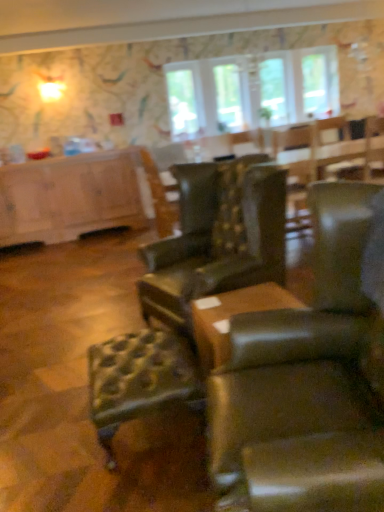
Question: Does leather tufted bar stool at center have a larger size compared to clear glass window at upper center, arranged as the 2th window screen when viewed from the right?

Choices:
 (A) no
 (B) yes

Answer: (B)

Question: Is leather tufted bar stool at center oriented towards clear glass window at upper center, arranged as the 2th window screen when viewed from the right?

Choices:
 (A) yes
 (B) no

Answer: (B)

Question: From the image's perspective, would you say leather tufted bar stool at center is shown under clear glass window at upper center, arranged as the 2th window screen when viewed from the right?

Choices:
 (A) yes
 (B) no

Answer: (A)

Question: Is leather tufted bar stool at center far from clear glass window at upper center, arranged as the 2th window screen when viewed from the right?

Choices:
 (A) no
 (B) yes

Answer: (B)

Question: Is leather tufted bar stool at center next to clear glass window at upper center, which appears as the first window screen when viewed from the left, and touching it?

Choices:
 (A) no
 (B) yes

Answer: (A)

Question: Can you confirm if leather tufted bar stool at center is positioned to the left of clear glass window at upper center, arranged as the 2th window screen when viewed from the right?

Choices:
 (A) yes
 (B) no

Answer: (A)

Question: From the image's perspective, is leather at center, the second chair from the back, beneath clear glass window at upper center, arranged as the 2th window screen when viewed from the right?

Choices:
 (A) no
 (B) yes

Answer: (B)

Question: From the image's perspective, is leather at center, which appears as the 1th chair when viewed from the front, on top of clear glass window at upper center, arranged as the 2th window screen when viewed from the right?

Choices:
 (A) yes
 (B) no

Answer: (B)

Question: Is leather at center, the second chair from the back, positioned with its back to clear glass window at upper center, arranged as the 2th window screen when viewed from the right?

Choices:
 (A) yes
 (B) no

Answer: (B)

Question: Is leather at center, which appears as the 1th chair when viewed from the front, wider than clear glass window at upper center, arranged as the 2th window screen when viewed from the right?

Choices:
 (A) no
 (B) yes

Answer: (B)

Question: Is leather at center, the second chair from the back, thinner than clear glass window at upper center, arranged as the 2th window screen when viewed from the right?

Choices:
 (A) no
 (B) yes

Answer: (A)

Question: From a real-world perspective, is leather at center, the second chair from the back, on top of clear glass window at upper center, which appears as the first window screen when viewed from the left?

Choices:
 (A) yes
 (B) no

Answer: (B)

Question: Is the position of clear glass window at upper center, which appears as the first window when viewed from the right, less distant than that of brown leather ottoman at center?

Choices:
 (A) yes
 (B) no

Answer: (B)